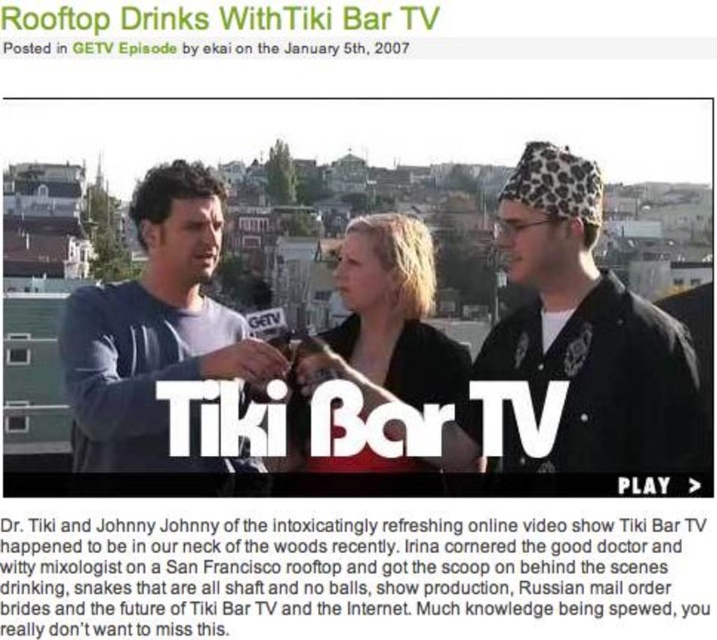
Is black paper text at center below blonde hair at center?

Yes.

Describe the element at coordinates (351, 572) in the screenshot. This screenshot has width=717, height=640. I see `black paper text at center` at that location.

Locate an element on the screen. This screenshot has width=717, height=640. black paper text at center is located at coordinates (351, 572).

Is leopard print hat at upper right below matte blue shirt at center?

No, leopard print hat at upper right is not below matte blue shirt at center.

Which of these two, leopard print hat at upper right or matte blue shirt at center, stands taller?

Standing taller between the two is matte blue shirt at center.

Is point (541, 330) positioned after point (222, 205)?

No, (541, 330) is in front of (222, 205).

I want to click on leopard print hat at upper right, so click(x=587, y=333).

Looking at this image, who is more forward, [118,385] or [300,460]?

Point [118,385] is in front.

Who is more distant from viewer, (151, 224) or (402, 368)?

The point (402, 368) is behind.

At what (x,y) coordinates should I click in order to perform the action: click on matte blue shirt at center. Please return your answer as a coordinate pair (x, y). Looking at the image, I should click on [x=156, y=332].